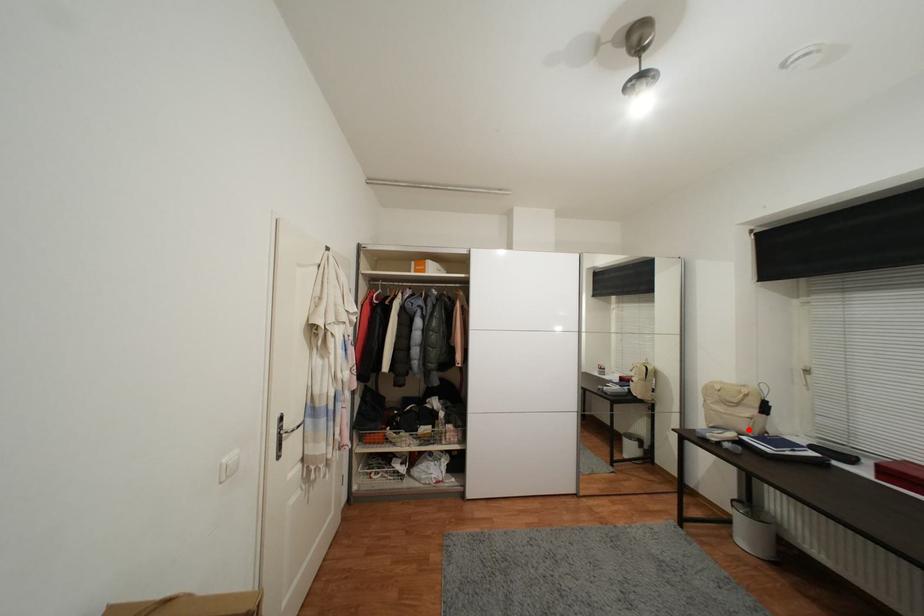
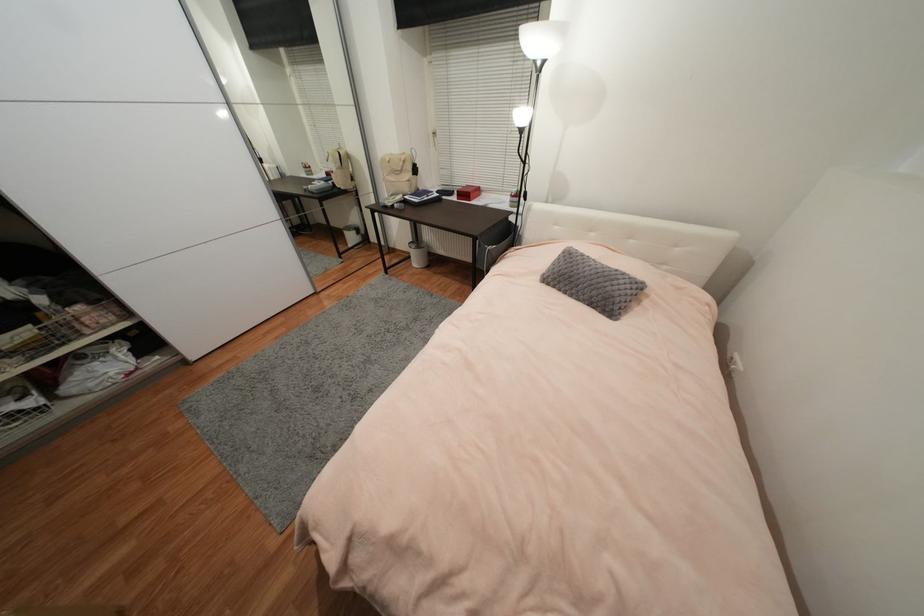
The point at the highlighted location is marked in the first image. Where is the corresponding point in the second image?

(410, 191)